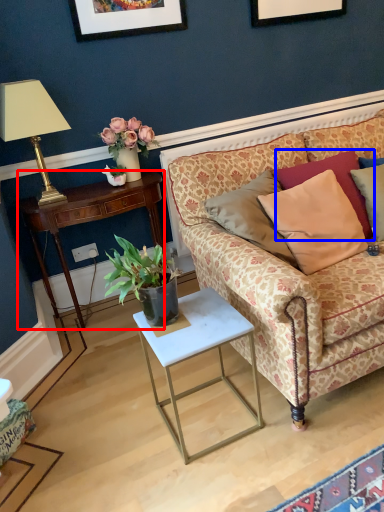
Question: Among these objects, which one is nearest to the camera, desk (highlighted by a red box) or pillow (highlighted by a blue box)?

Choices:
 (A) desk
 (B) pillow

Answer: (B)